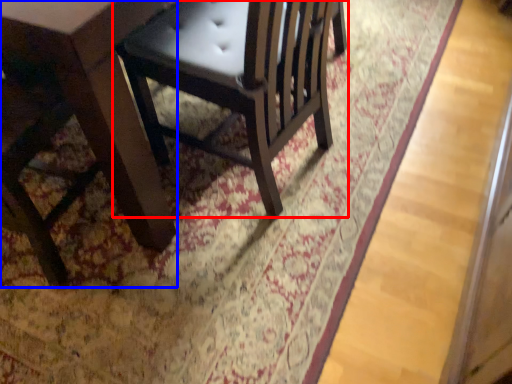
Question: Which of the following is the closest to the observer, chair (highlighted by a red box) or table (highlighted by a blue box)?

Choices:
 (A) chair
 (B) table

Answer: (B)